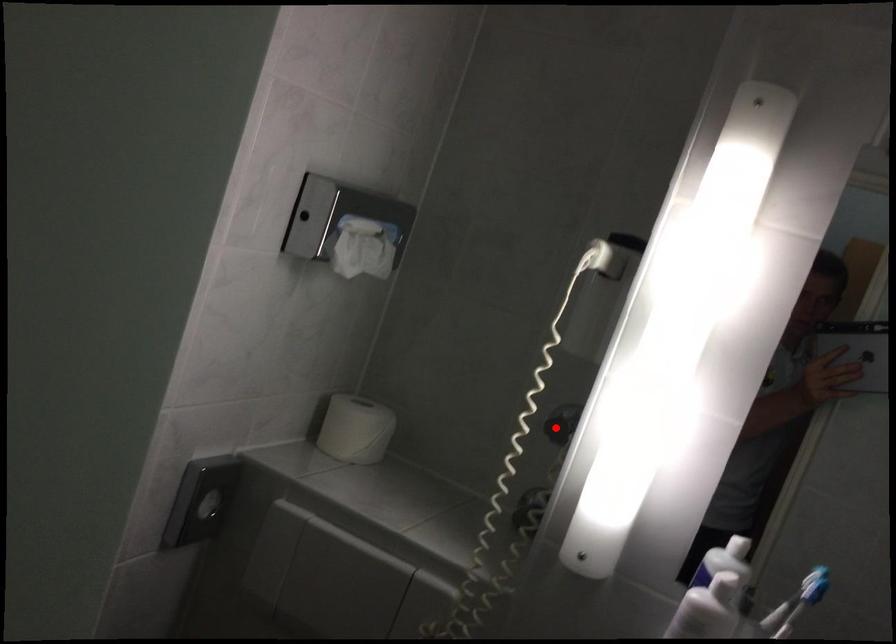
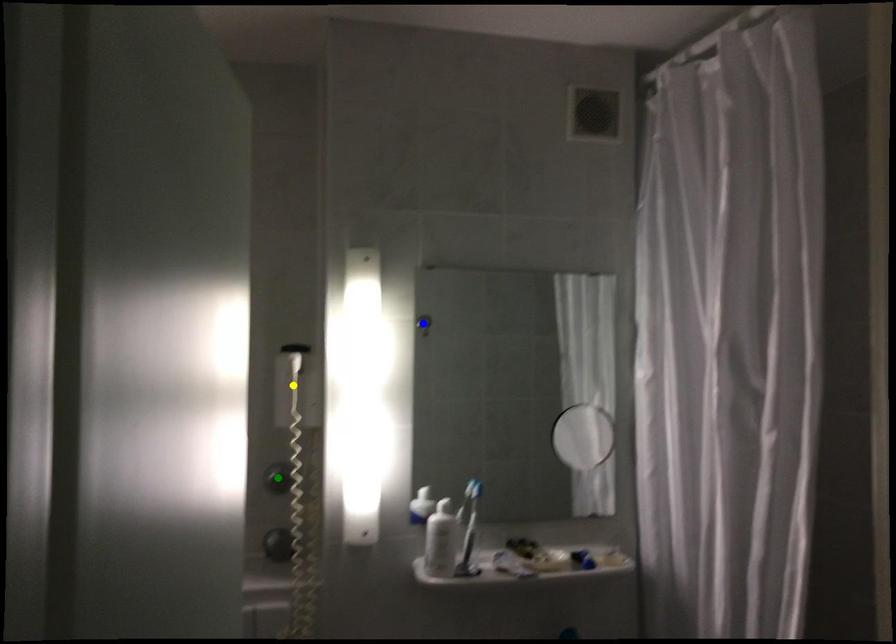
Question: I am providing you with two images of the same scene from different viewpoints. A red point is marked on the first image. You are given multiple points on the second image. Can you choose the point in image 2 that corresponds to the point in image 1?

Choices:
 (A) green point
 (B) blue point
 (C) yellow point

Answer: (A)